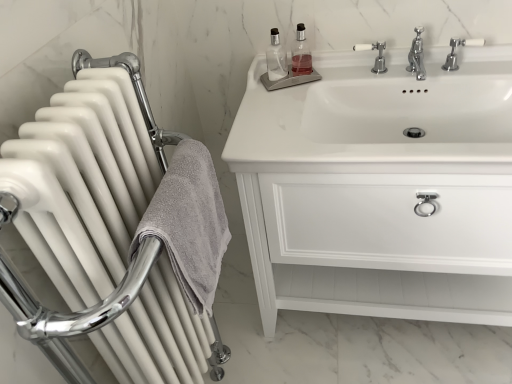
Find the location of a particular element. Image resolution: width=512 pixels, height=384 pixels. vacant space to the right of white ceramic tap at upper center, the first tap positioned from the left is located at coordinates (411, 68).